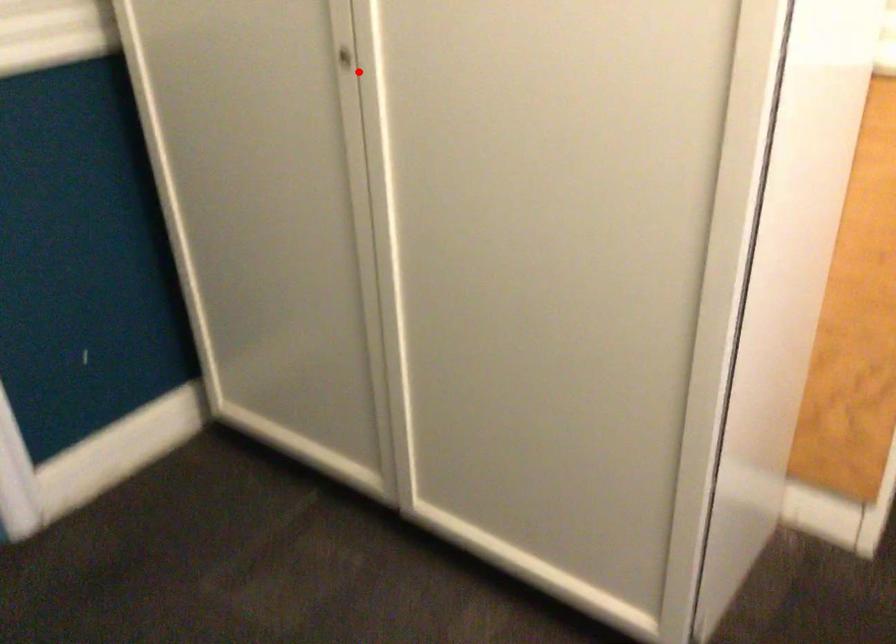
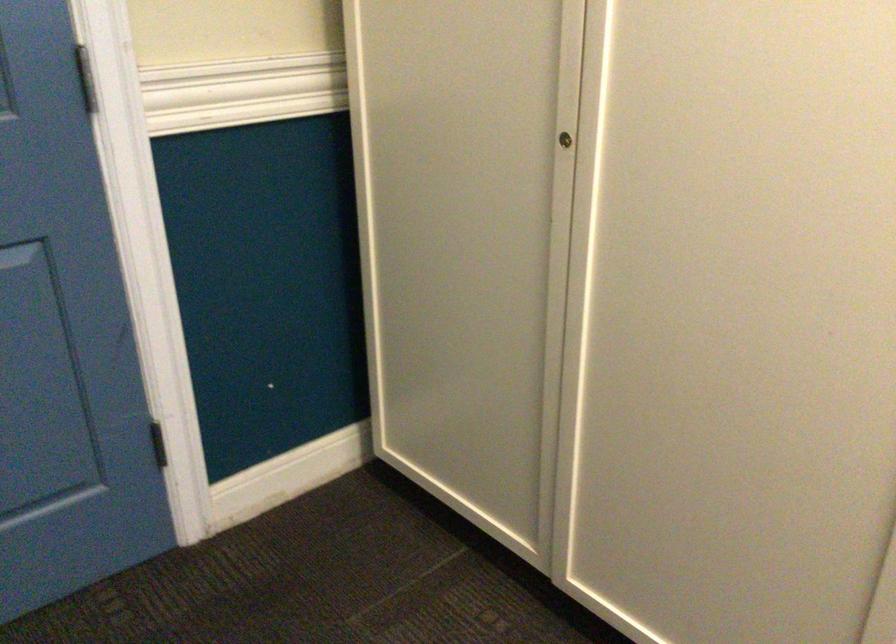
Question: I am providing you with two images of the same scene from different viewpoints. A red point is marked on the first image. Is the red point's position out of view in image 2?

Choices:
 (A) Yes
 (B) No

Answer: (B)